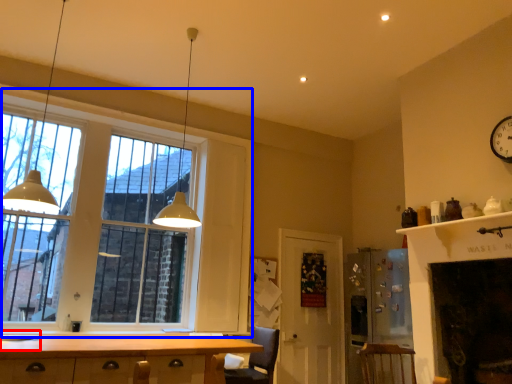
Question: Among these objects, which one is nearest to the camera, sink (highlighted by a red box) or window (highlighted by a blue box)?

Choices:
 (A) sink
 (B) window

Answer: (A)